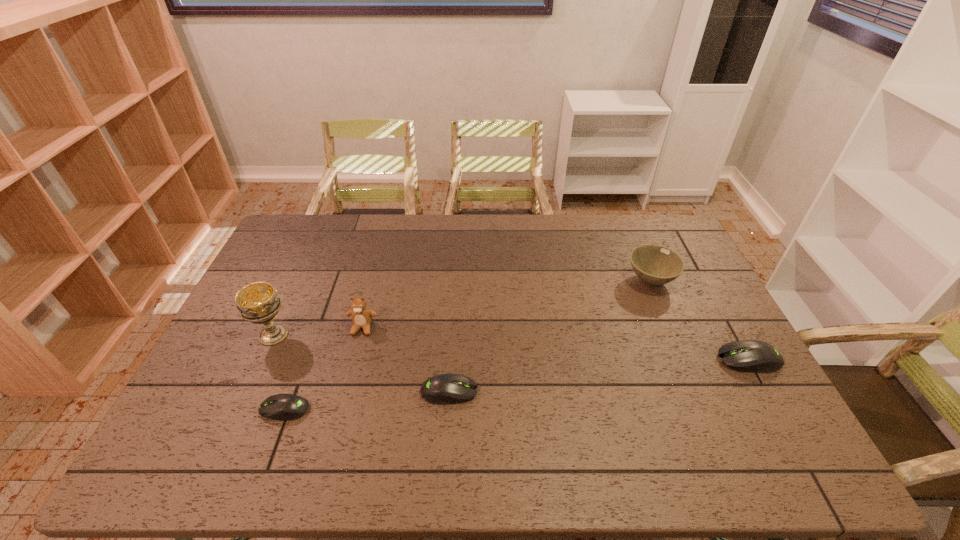
The height and width of the screenshot is (540, 960). In order to click on free location that satisfies the following two spatial constraints: 1. on the front-facing side of the fifth shortest object; 2. on the wheel side of the shortest object in this screenshot , I will do `click(341, 409)`.

You are a GUI agent. You are given a task and a screenshot of the screen. Output one action in this format:
    pyautogui.click(x=<x>, y=<y>)
    Task: Click on the vacant space that satisfies the following two spatial constraints: 1. on the front-facing side of the third object from left to right; 2. on the wheel side of the shortest computer mouse
    
    Given the screenshot: What is the action you would take?
    pyautogui.click(x=341, y=409)